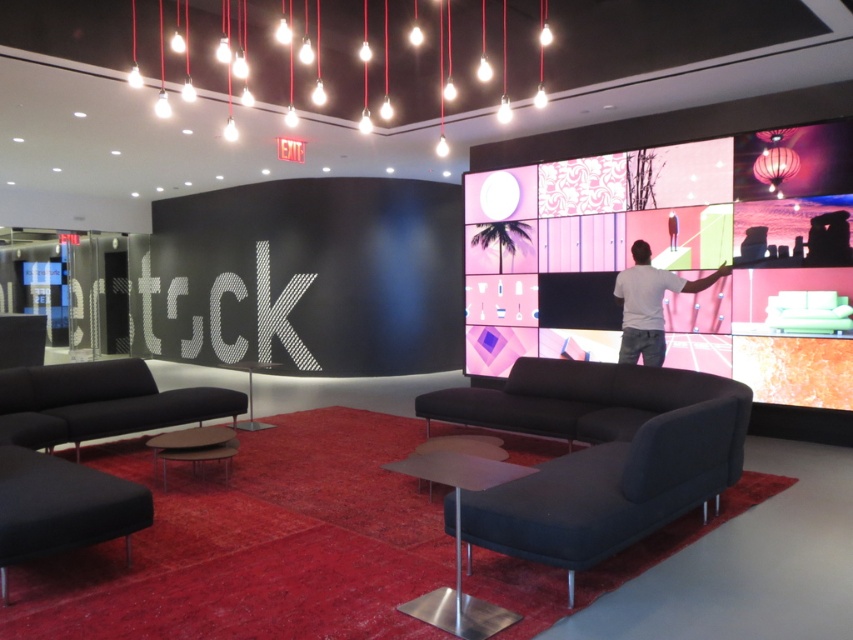
Question: Considering the relative positions of black fabric couch at left and smooth leather stool at center in the image provided, where is black fabric couch at left located with respect to smooth leather stool at center?

Choices:
 (A) above
 (B) below

Answer: (A)

Question: Which point is closer to the camera?

Choices:
 (A) gray matte shirt at upper right
 (B) smooth leather stool at center
 (C) black fabric couch at left

Answer: (B)

Question: Which of the following is the farthest from the observer?

Choices:
 (A) (674, 291)
 (B) (428, 488)
 (C) (10, 369)

Answer: (A)

Question: In this image, where is black fabric couch at left located relative to smooth leather stool at center?

Choices:
 (A) left
 (B) right

Answer: (A)

Question: Is gray matte shirt at upper right bigger than smooth leather stool at center?

Choices:
 (A) yes
 (B) no

Answer: (A)

Question: Considering the real-world distances, which object is closest to the black fabric couch at left?

Choices:
 (A) gray matte shirt at upper right
 (B) smooth leather stool at center

Answer: (B)